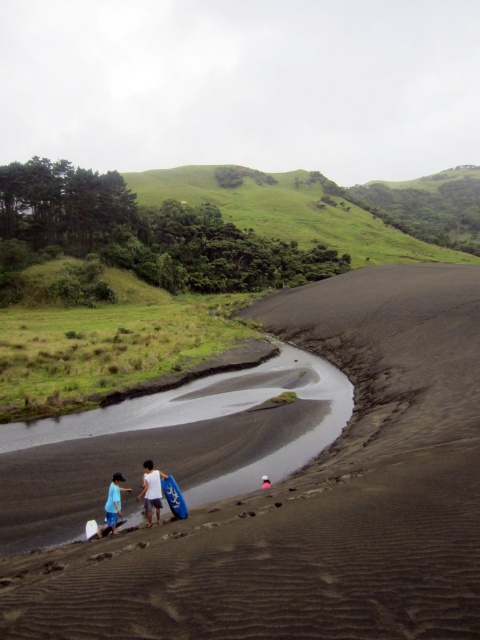
Question: Is black sand beach at lower center below black sand river at lower center?

Choices:
 (A) no
 (B) yes

Answer: (A)

Question: Which object is positioned farthest from the blue foam surfboard at lower left?

Choices:
 (A) black sand beach at lower center
 (B) pink fabric at center
 (C) blue matte surfboard at lower center
 (D) black sand river at lower center

Answer: (A)

Question: Estimate the real-world distances between objects in this image. Which object is farther from the black sand beach at lower center?

Choices:
 (A) black sand river at lower center
 (B) blue matte surfboard at lower center
 (C) white matte surfboard at lower center

Answer: (B)

Question: Which point is farther from the camera taking this photo?

Choices:
 (A) (44, 420)
 (B) (159, 499)

Answer: (A)

Question: Does white matte surfboard at lower center appear on the left side of blue foam surfboard at lower left?

Choices:
 (A) no
 (B) yes

Answer: (A)

Question: Is black sand beach at lower center to the left of blue foam surfboard at lower left from the viewer's perspective?

Choices:
 (A) yes
 (B) no

Answer: (B)